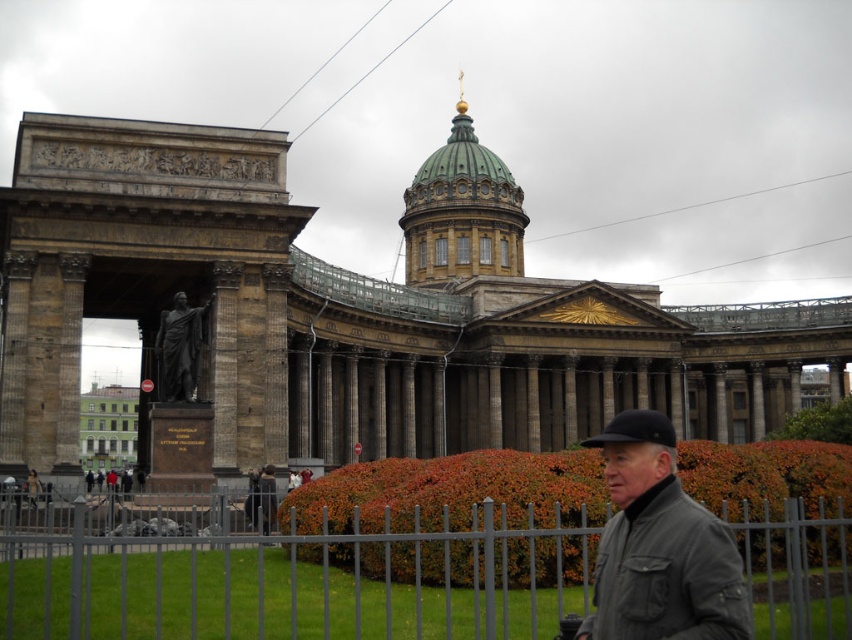
Question: Which point is closer to the camera?

Choices:
 (A) metallic gray fence at lower center
 (B) dark gray jacket at lower right
 (C) brown stone palace at center

Answer: (B)

Question: In this image, where is dark gray jacket at lower right located relative to polished bronze statue at center?

Choices:
 (A) right
 (B) left

Answer: (A)

Question: Considering the real-world distances, which object is closest to the black fabric cap at center?

Choices:
 (A) brown stone palace at center
 (B) dark gray jacket at lower right
 (C) metallic gray fence at lower center
 (D) polished bronze statue at center

Answer: (B)

Question: Does metallic gray fence at lower center lie behind polished bronze statue at center?

Choices:
 (A) no
 (B) yes

Answer: (A)

Question: Which object is the closest to the black fabric cap at center?

Choices:
 (A) dark gray jacket at lower right
 (B) brown stone palace at center
 (C) polished bronze statue at center

Answer: (A)

Question: Is metallic gray fence at lower center to the right of polished bronze statue at center from the viewer's perspective?

Choices:
 (A) no
 (B) yes

Answer: (B)